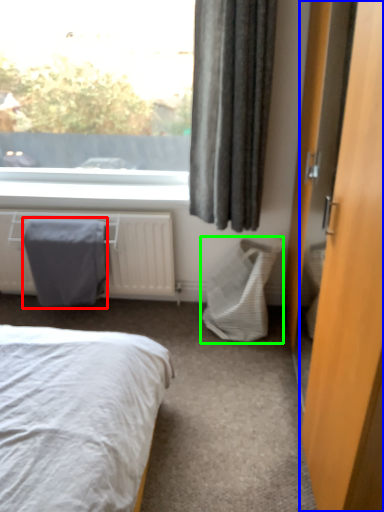
Question: Estimate the real-world distances between objects in this image. Which object is closer to blanket (highlighted by a red box), door (highlighted by a blue box) or laundry basket (highlighted by a green box)?

Choices:
 (A) door
 (B) laundry basket

Answer: (B)